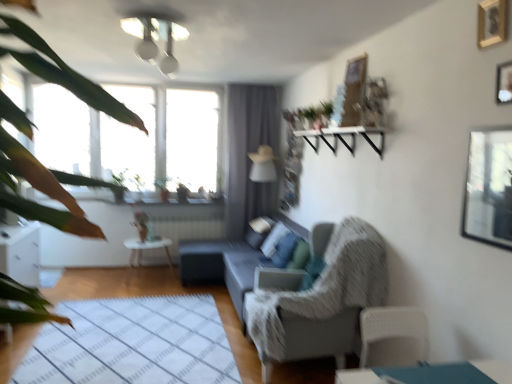
Question: Can you confirm if white glossy light fixture at upper center is bigger than wooden picture frame at upper right, the 2th picture frame from the bottom?

Choices:
 (A) no
 (B) yes

Answer: (B)

Question: Does white glossy light fixture at upper center have a lesser height compared to wooden picture frame at upper right, the 2th picture frame from the bottom?

Choices:
 (A) no
 (B) yes

Answer: (A)

Question: Is white glossy light fixture at upper center further to the viewer compared to wooden picture frame at upper right, which is counted as the first picture frame, starting from the top?

Choices:
 (A) no
 (B) yes

Answer: (B)

Question: Can you confirm if white glossy light fixture at upper center is positioned to the left of wooden picture frame at upper right, the 2th picture frame from the bottom?

Choices:
 (A) no
 (B) yes

Answer: (B)

Question: Does white glossy light fixture at upper center have a greater height compared to wooden picture frame at upper right, which is counted as the first picture frame, starting from the top?

Choices:
 (A) no
 (B) yes

Answer: (B)

Question: Can you confirm if white glossy light fixture at upper center is thinner than wooden picture frame at upper right, the 2th picture frame from the bottom?

Choices:
 (A) no
 (B) yes

Answer: (A)

Question: Are wooden picture frame at upper right, which is the 1th picture frame in bottom-to-top order, and white glossy side table at center beside each other?

Choices:
 (A) yes
 (B) no

Answer: (B)

Question: Is wooden picture frame at upper right, the 2th picture frame viewed from the top, bigger than white glossy side table at center?

Choices:
 (A) no
 (B) yes

Answer: (A)

Question: Could you tell me if wooden picture frame at upper right, the 2th picture frame viewed from the top, is facing white glossy side table at center?

Choices:
 (A) yes
 (B) no

Answer: (B)

Question: Considering the relative sizes of wooden picture frame at upper right, the 2th picture frame viewed from the top, and white glossy side table at center in the image provided, is wooden picture frame at upper right, the 2th picture frame viewed from the top, smaller than white glossy side table at center?

Choices:
 (A) no
 (B) yes

Answer: (B)

Question: Is wooden picture frame at upper right, which is the 1th picture frame in bottom-to-top order, not close to white glossy side table at center?

Choices:
 (A) no
 (B) yes

Answer: (B)

Question: Can you confirm if wooden picture frame at upper right, the 2th picture frame viewed from the top, is positioned to the left of white glossy side table at center?

Choices:
 (A) no
 (B) yes

Answer: (A)

Question: Would you say white glossy light fixture at upper center contains transparent glass window screen at upper right?

Choices:
 (A) no
 (B) yes

Answer: (A)